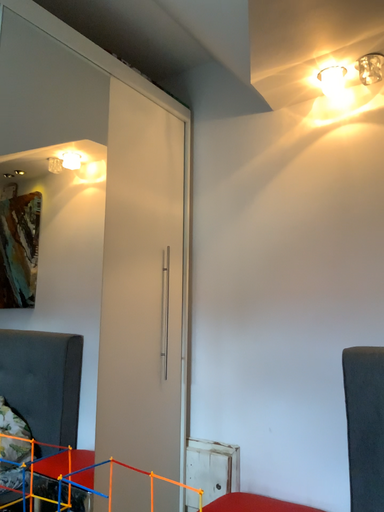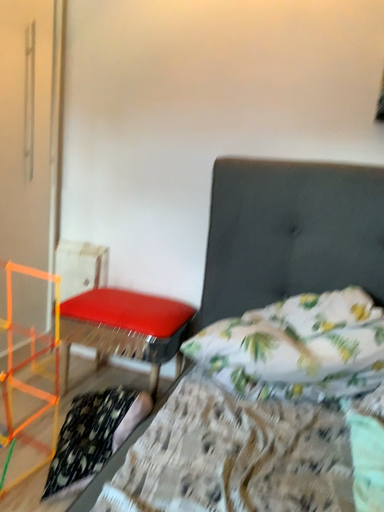
Question: How did the camera likely rotate when shooting the video?

Choices:
 (A) rotated left
 (B) rotated right

Answer: (B)